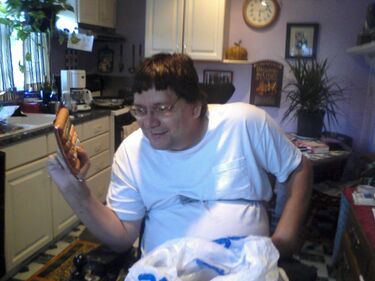
The height and width of the screenshot is (281, 375). I want to click on clock, so click(x=264, y=12).